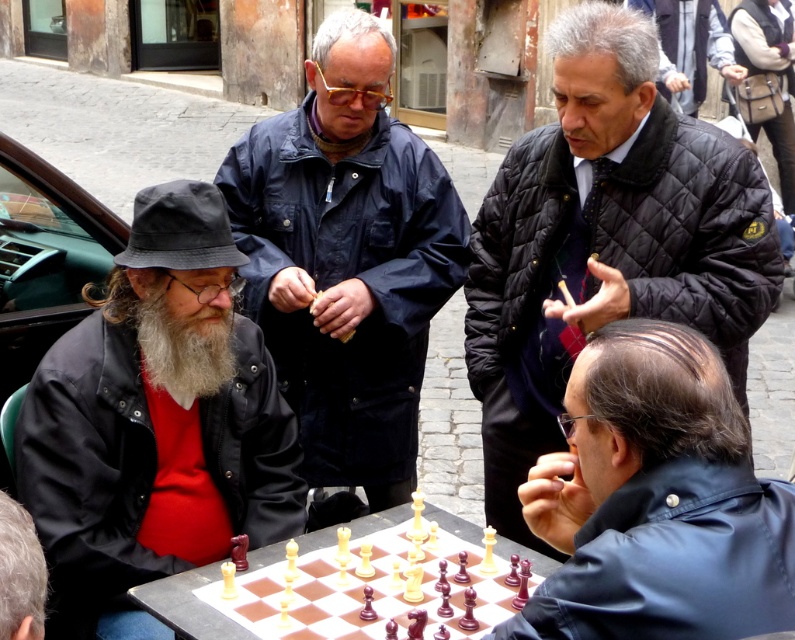
You are a tailor measuring jackets for customers. You have two jackets in front of you, the matte black jacket at left and the shiny black jacket at lower right. Which one has a larger width according to the description?

The matte black jacket at left is wider than the shiny black jacket at lower right according to the description.

You are a photographer standing at the center of the street scene. You want to take a photo that includes both the matte black jacket at left and the dark gray quilted jacket at upper right. Given the distance between them, will you be able to frame both in a single shot without moving your position?

The matte black jacket at left is 9.19 meters away from the dark gray quilted jacket at upper right. Since the distance between them is quite large, it may be challenging to frame both in a single shot without moving your position, depending on the camera lens used. A wide angle lens might be necessary to capture both subjects in the frame.